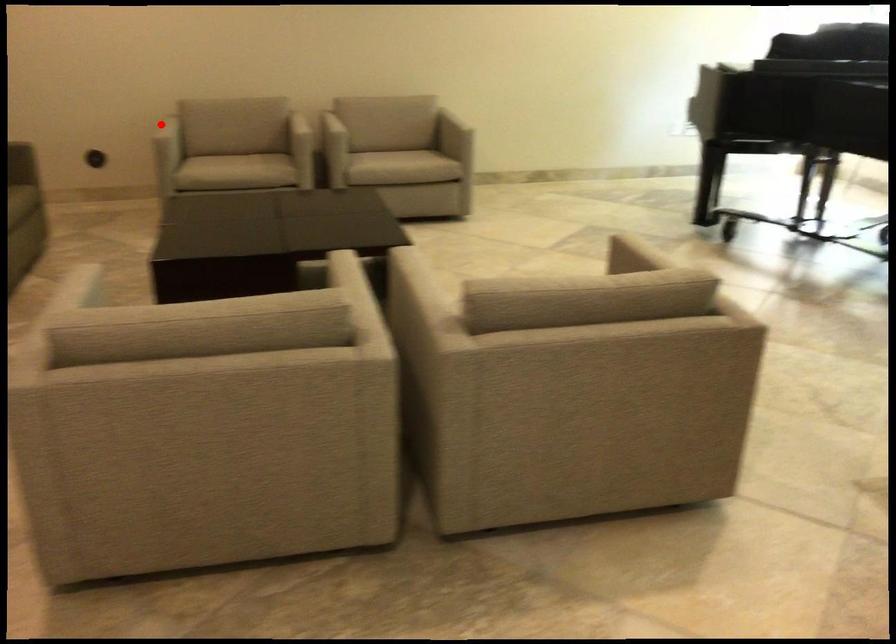
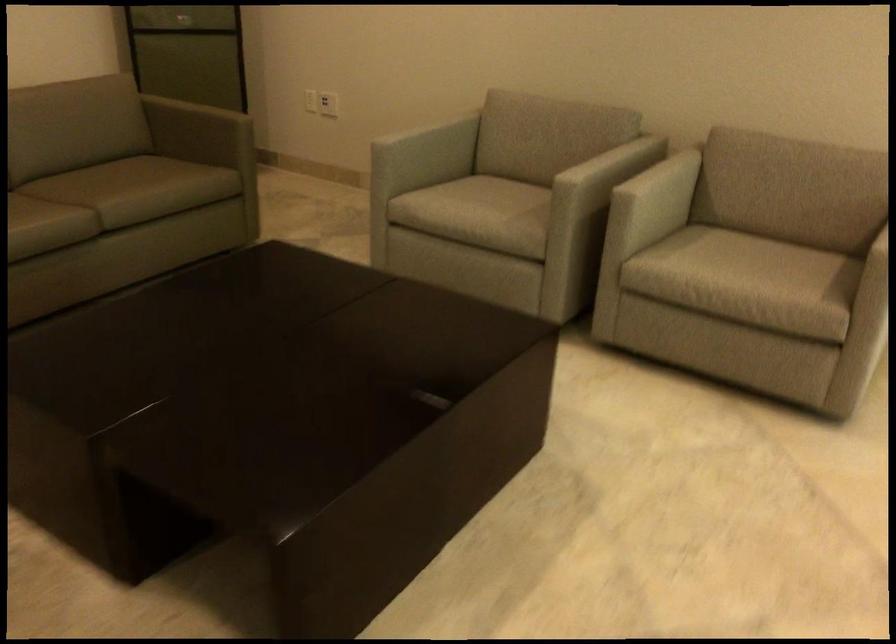
Question: I am providing you with two images of the same scene from different viewpoints. A red point is marked on the first image. At the location where the point appears in image 1, is it still visible in image 2?

Choices:
 (A) Yes
 (B) No

Answer: (A)